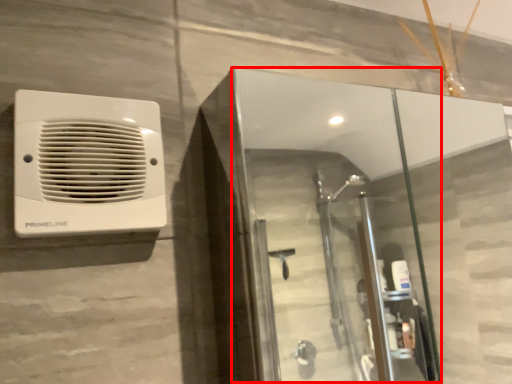
Question: From the image's perspective, what is the correct spatial relationship of screen door (annotated by the red box) in relation to home appliance?

Choices:
 (A) above
 (B) below

Answer: (B)